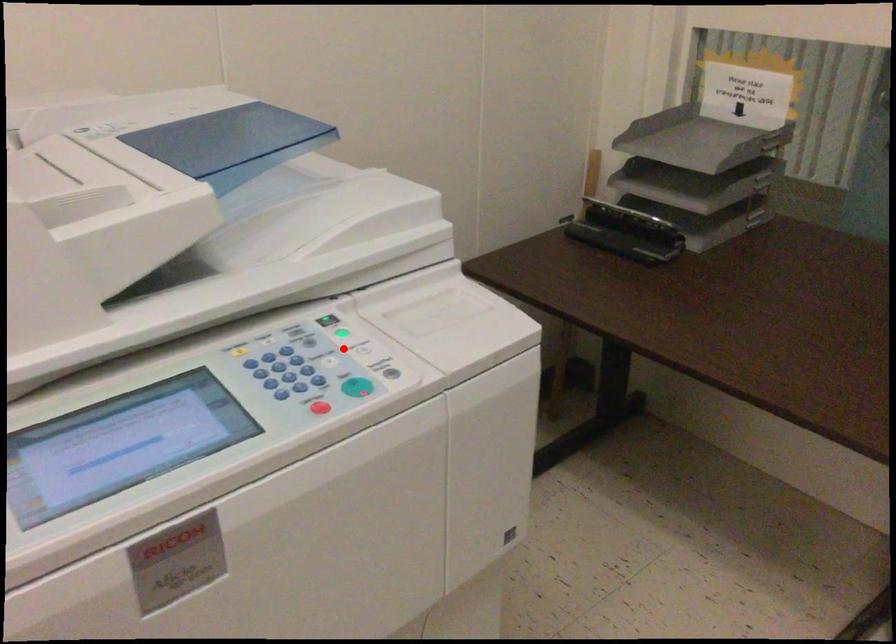
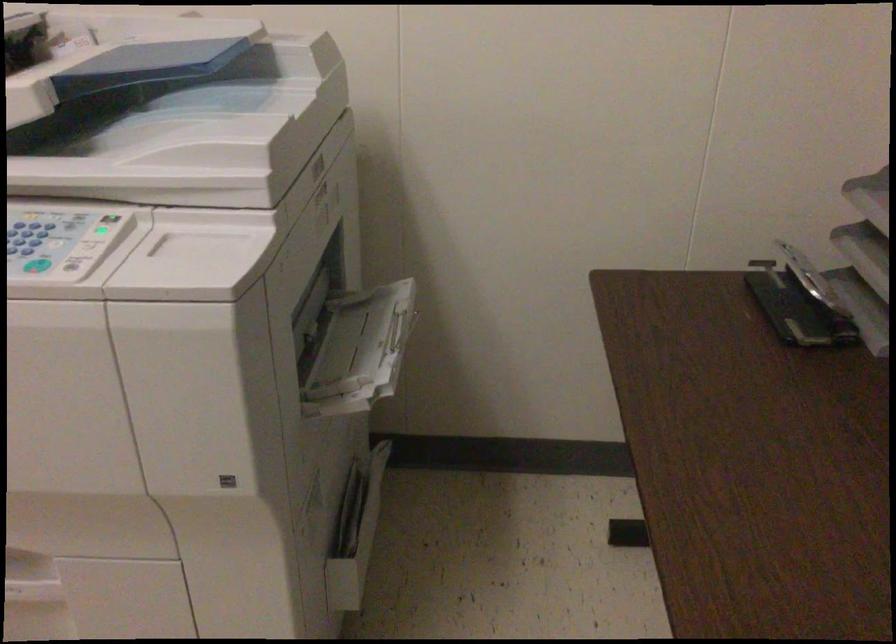
Find the pixel in the second image that matches the highlighted location in the first image.

(92, 241)